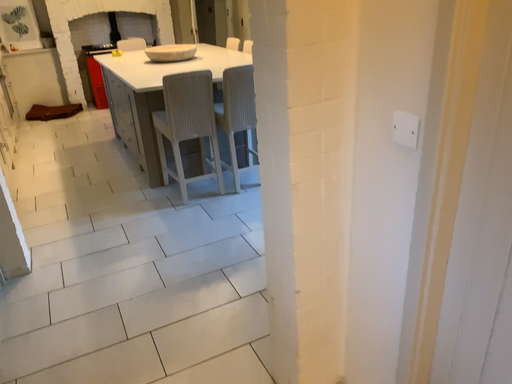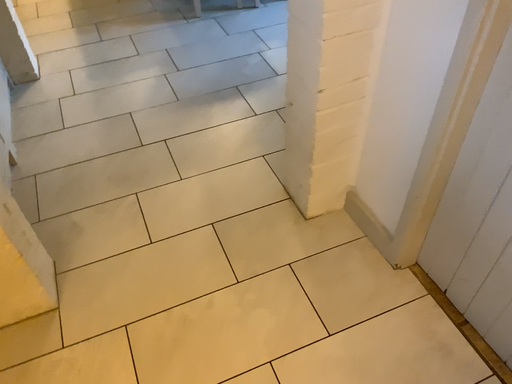
Question: Which way did the camera rotate in the video?

Choices:
 (A) rotated downward
 (B) rotated upward

Answer: (A)